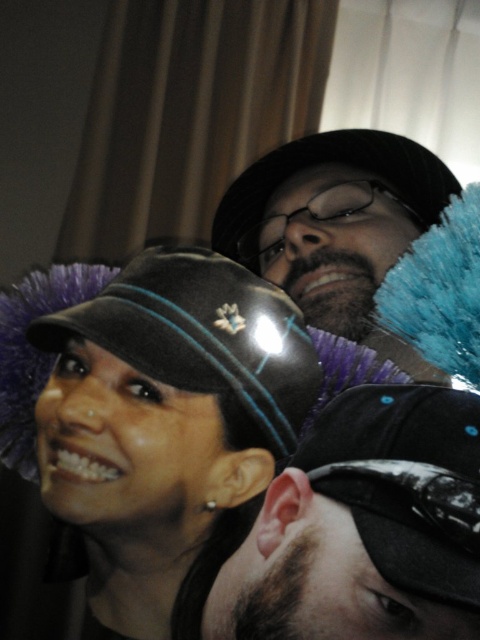
Question: Can you confirm if black shiny cap at center is smaller than matte black hat at center?

Choices:
 (A) no
 (B) yes

Answer: (B)

Question: Estimate the real-world distances between objects in this image. Which object is closer to the matte black cap at center?

Choices:
 (A) black shiny cap at center
 (B) matte black hat at center

Answer: (A)

Question: Which point is closer to the camera taking this photo?

Choices:
 (A) 171,344
 (B) 407,577
 (C) 305,234

Answer: (B)

Question: Where is black shiny cap at center located in relation to matte black hat at center in the image?

Choices:
 (A) below
 (B) above

Answer: (A)

Question: Does matte black cap at center appear on the left side of matte black hat at center?

Choices:
 (A) no
 (B) yes

Answer: (B)

Question: Which point is farther to the camera?

Choices:
 (A) matte black cap at center
 (B) black shiny cap at center
 (C) matte black hat at center

Answer: (C)